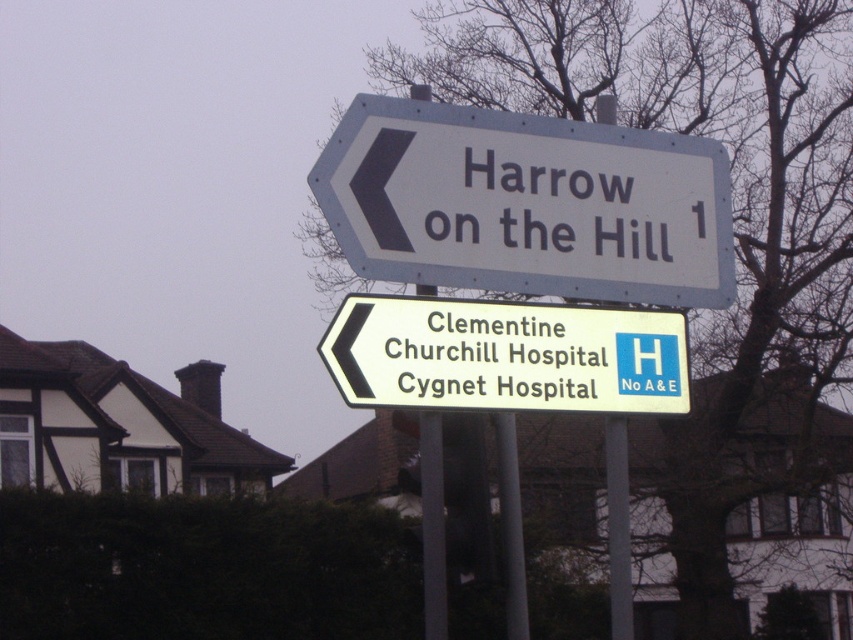
Between point (703, 237) and point (519, 333), which one is positioned behind?

Point (703, 237)

Between white plastic sign at upper center and white plastic sign at lower center, which one appears on the right side from the viewer's perspective?

Positioned to the right is white plastic sign at lower center.

The width and height of the screenshot is (853, 640). Describe the element at coordinates (526, 204) in the screenshot. I see `white plastic sign at upper center` at that location.

Identify the location of white plastic sign at upper center. The width and height of the screenshot is (853, 640). (526, 204).

Between white plastic sign at upper center and metallic pole at center, which one is positioned lower?

metallic pole at center

Is point (395, 156) positioned after point (425, 563)?

No, it is in front of (425, 563).

The width and height of the screenshot is (853, 640). In order to click on white plastic sign at upper center in this screenshot , I will do `click(526, 204)`.

This screenshot has width=853, height=640. Identify the location of white plastic sign at upper center. (526, 204).

Which is in front, point (405, 330) or point (428, 540)?

Point (405, 330) is more forward.

Is white plastic sign at lower center thinner than metallic pole at center?

Incorrect, white plastic sign at lower center's width is not less than metallic pole at center's.

Who is more forward, [674,410] or [444,614]?

Point [444,614] is in front.

Locate an element on the screen. white plastic sign at lower center is located at coordinates (505, 355).